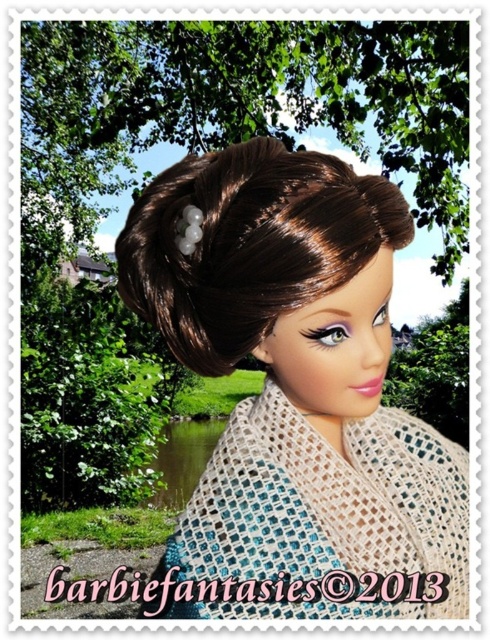
Which of these two, matte brown hair at center or brown shiny hair bun at center, stands taller?

matte brown hair at center is taller.

Where is `matte brown hair at center`? This screenshot has width=490, height=640. matte brown hair at center is located at coordinates (295, 380).

Where is `matte brown hair at center`? The height and width of the screenshot is (640, 490). matte brown hair at center is located at coordinates (295, 380).

Based on the photo, which is below, matte brown hair at center or crochet beige shawl at center?

Positioned lower is crochet beige shawl at center.

Which is behind, point (423, 612) or point (314, 444)?

The point (423, 612) is more distant.

Where is `matte brown hair at center`? The height and width of the screenshot is (640, 490). matte brown hair at center is located at coordinates (295, 380).

Does crochet beige shawl at center appear under brown shiny hair bun at center?

Indeed, crochet beige shawl at center is positioned under brown shiny hair bun at center.

Can you confirm if crochet beige shawl at center is positioned to the right of brown shiny hair bun at center?

Correct, you'll find crochet beige shawl at center to the right of brown shiny hair bun at center.

Does point (289, 472) come farther from viewer compared to point (157, 211)?

Yes.

Image resolution: width=490 pixels, height=640 pixels. In order to click on crochet beige shawl at center in this screenshot , I will do `click(324, 512)`.